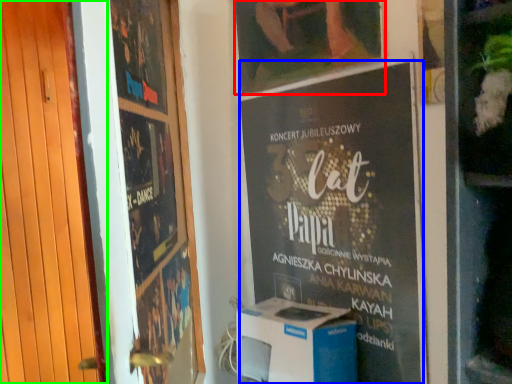
Question: Estimate the real-world distances between objects in this image. Which object is closer to picture frame (highlighted by a red box), poster (highlighted by a blue box) or door (highlighted by a green box)?

Choices:
 (A) poster
 (B) door

Answer: (A)